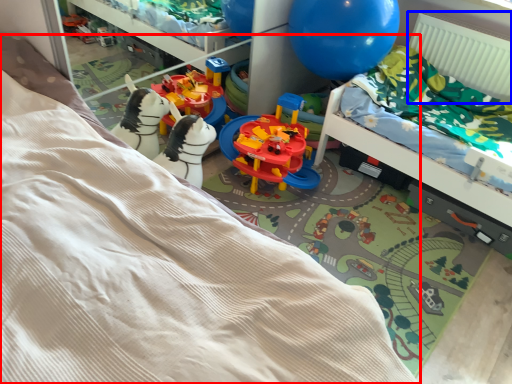
Question: Among these objects, which one is nearest to the camera, bed (highlighted by a red box) or radiator (highlighted by a blue box)?

Choices:
 (A) bed
 (B) radiator

Answer: (A)